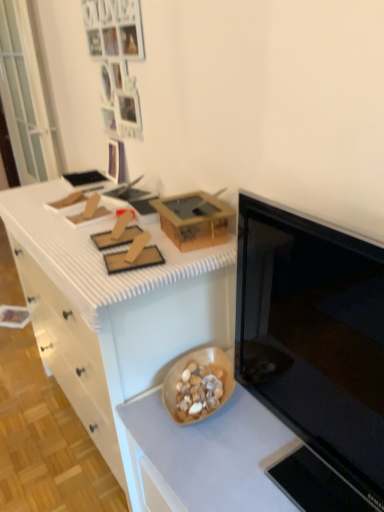
Question: Is wooden bowl at lower center, which is the 2th countertop from top to bottom, wider than wooden bowl at lower center?

Choices:
 (A) no
 (B) yes

Answer: (B)

Question: Does wooden bowl at lower center, the first countertop when ordered from bottom to top, have a larger size compared to wooden bowl at lower center?

Choices:
 (A) no
 (B) yes

Answer: (B)

Question: Is wooden bowl at lower center, which is the 2th countertop from top to bottom, in front of wooden bowl at lower center?

Choices:
 (A) yes
 (B) no

Answer: (A)

Question: From a real-world perspective, is wooden bowl at lower center, which is the 2th countertop from top to bottom, located higher than wooden bowl at lower center?

Choices:
 (A) yes
 (B) no

Answer: (B)

Question: Can you confirm if wooden bowl at lower center, which is the 2th countertop from top to bottom, is positioned to the left of wooden bowl at lower center?

Choices:
 (A) no
 (B) yes

Answer: (A)

Question: Considering the positions of black glossy microwave at right and wooden bowl at lower center in the image, is black glossy microwave at right taller or shorter than wooden bowl at lower center?

Choices:
 (A) short
 (B) tall

Answer: (B)

Question: Does point (340, 423) appear closer or farther from the camera than point (208, 384)?

Choices:
 (A) closer
 (B) farther

Answer: (A)

Question: Is black glossy microwave at right inside or outside of wooden bowl at lower center?

Choices:
 (A) inside
 (B) outside

Answer: (B)

Question: Looking at their shapes, would you say black glossy microwave at right is wider or thinner than wooden bowl at lower center?

Choices:
 (A) wide
 (B) thin

Answer: (B)

Question: Choose the correct answer: Is matte brown cardboard box at center inside white matte drawer at left or outside it?

Choices:
 (A) outside
 (B) inside

Answer: (A)

Question: Considering the positions of point (203, 242) and point (77, 415), is point (203, 242) closer or farther from the camera than point (77, 415)?

Choices:
 (A) farther
 (B) closer

Answer: (B)

Question: Looking at their shapes, would you say matte brown cardboard box at center is wider or thinner than white matte drawer at left?

Choices:
 (A) thin
 (B) wide

Answer: (A)

Question: Considering the positions of matte brown cardboard box at center and white matte drawer at left in the image, is matte brown cardboard box at center taller or shorter than white matte drawer at left?

Choices:
 (A) tall
 (B) short

Answer: (A)

Question: Is wooden bowl at lower center, the first countertop when ordered from bottom to top, to the left or to the right of transparent glass door at left in the image?

Choices:
 (A) right
 (B) left

Answer: (A)

Question: Is wooden bowl at lower center, the first countertop when ordered from bottom to top, bigger or smaller than transparent glass door at left?

Choices:
 (A) big
 (B) small

Answer: (A)